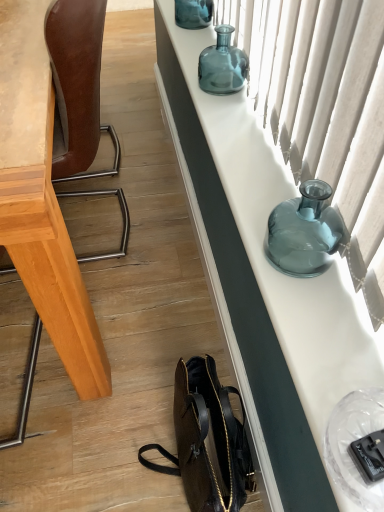
Measure the distance between brown leather handbag at lower center and camera.

They are 34.53 inches apart.

The image size is (384, 512). What do you see at coordinates (263, 281) in the screenshot?
I see `matte glass vase at upper right` at bounding box center [263, 281].

Consider the image. What is the approximate width of brown leather chair at left?

It is 40.43 centimeters.

Find the location of `teal glass vase at upper center, the third bottle when ordered from bottom to top`. teal glass vase at upper center, the third bottle when ordered from bottom to top is located at coordinates (193, 13).

Describe the element at coordinates (193, 13) in the screenshot. Image resolution: width=384 pixels, height=512 pixels. I see `teal glass vase at upper center, the 3th bottle viewed from the front` at that location.

Image resolution: width=384 pixels, height=512 pixels. What do you see at coordinates (304, 232) in the screenshot? I see `translucent glass vase at upper right, the 3th bottle viewed from the top` at bounding box center [304, 232].

Where is `brown leather handbag at lower center`? This screenshot has width=384, height=512. brown leather handbag at lower center is located at coordinates (208, 441).

Is translucent glass vase at upper center, which ranks as the 2th bottle in top-to-bottom order, completely or partially outside of brown leather handbag at lower center?

That's correct, translucent glass vase at upper center, which ranks as the 2th bottle in top-to-bottom order, is outside of brown leather handbag at lower center.

In the image, is translucent glass vase at upper center, the second bottle when ordered from bottom to top, positioned in front of or behind brown leather handbag at lower center?

In the image, translucent glass vase at upper center, the second bottle when ordered from bottom to top, appears behind brown leather handbag at lower center.

Is translucent glass vase at upper center, which ranks as the 2th bottle in top-to-bottom order, with brown leather handbag at lower center?

translucent glass vase at upper center, which ranks as the 2th bottle in top-to-bottom order, and brown leather handbag at lower center are not in contact.

Is translucent glass vase at upper center, the second bottle in the back-to-front sequence, aimed at brown leather handbag at lower center?

No, translucent glass vase at upper center, the second bottle in the back-to-front sequence, does not turn towards brown leather handbag at lower center.

Could you tell me if brown leather handbag at lower center is turned towards translucent glass vase at upper right, positioned as the 1th bottle in front-to-back order?

No.

The width and height of the screenshot is (384, 512). In order to click on bottle that is the 2nd one when counting rightward from the brown leather handbag at lower center in this screenshot , I will do `click(304, 232)`.

Is point (189, 488) closer or farther from the camera than point (318, 264)?

Point (189, 488) appears to be farther away from the viewer than point (318, 264).

Is brown leather handbag at lower center located outside translucent glass vase at upper right, positioned as the 1th bottle in front-to-back order?

brown leather handbag at lower center lies outside translucent glass vase at upper right, positioned as the 1th bottle in front-to-back order,'s area.

Does point (252, 433) come closer to viewer compared to point (224, 29)?

That is True.

Is matte glass vase at upper right bigger than translucent glass vase at upper center, the second bottle viewed from the front?

Correct, matte glass vase at upper right is larger in size than translucent glass vase at upper center, the second bottle viewed from the front.

Considering the relative positions of matte glass vase at upper right and translucent glass vase at upper center, the second bottle viewed from the front, in the image provided, is matte glass vase at upper right to the left of translucent glass vase at upper center, the second bottle viewed from the front, from the viewer's perspective?

Incorrect, matte glass vase at upper right is not on the left side of translucent glass vase at upper center, the second bottle viewed from the front.

Is translucent glass vase at upper center, the second bottle viewed from the front, a part of matte glass vase at upper right?

No, translucent glass vase at upper center, the second bottle viewed from the front, is not a part of matte glass vase at upper right.

Considering the relative sizes of translucent fabric curtain at upper right and brown leather handbag at lower center in the image provided, is translucent fabric curtain at upper right wider than brown leather handbag at lower center?

Incorrect, the width of translucent fabric curtain at upper right does not surpass that of brown leather handbag at lower center.

Is translucent fabric curtain at upper right taller or shorter than brown leather handbag at lower center?

Clearly, translucent fabric curtain at upper right is taller compared to brown leather handbag at lower center.

Does translucent fabric curtain at upper right lie in front of brown leather handbag at lower center?

Yes.

Is translucent glass vase at upper center, the second bottle when ordered from bottom to top, smaller than translucent glass vase at upper right, the first bottle positioned from the bottom?

Indeed, translucent glass vase at upper center, the second bottle when ordered from bottom to top, has a smaller size compared to translucent glass vase at upper right, the first bottle positioned from the bottom.

Is translucent glass vase at upper center, the second bottle in the back-to-front sequence, touching translucent glass vase at upper right, positioned as the 1th bottle in front-to-back order?

No, translucent glass vase at upper center, the second bottle in the back-to-front sequence, is not next to translucent glass vase at upper right, positioned as the 1th bottle in front-to-back order.

From the image's perspective, would you say translucent glass vase at upper center, the second bottle when ordered from bottom to top, is shown under translucent glass vase at upper right, positioned as the 1th bottle in front-to-back order?

Incorrect, from the image's perspective, translucent glass vase at upper center, the second bottle when ordered from bottom to top, is higher than translucent glass vase at upper right, positioned as the 1th bottle in front-to-back order.

You are a GUI agent. You are given a task and a screenshot of the screen. Output one action in this format:
    pyautogui.click(x=<x>, y=<y>)
    Task: Click on the bottle that is the 1st one when counting backward from the translucent glass vase at upper right, the 3th bottle viewed from the top
    
    Given the screenshot: What is the action you would take?
    pyautogui.click(x=222, y=65)

Which of these two, matte glass vase at upper right or brown leather handbag at lower center, stands shorter?

Standing shorter between the two is matte glass vase at upper right.

Identify the location of cabinetry in front of the brown leather handbag at lower center. Image resolution: width=384 pixels, height=512 pixels. (263, 281).

Which is correct: matte glass vase at upper right is inside brown leather handbag at lower center, or outside of it?

matte glass vase at upper right lies outside brown leather handbag at lower center.

Can you confirm if matte glass vase at upper right is bigger than brown leather handbag at lower center?

No, matte glass vase at upper right is not bigger than brown leather handbag at lower center.

From the picture: Would you say brown leather handbag at lower center is a long distance from translucent fabric curtain at upper right?

brown leather handbag at lower center is actually quite close to translucent fabric curtain at upper right.

From a real-world perspective, is brown leather handbag at lower center positioned above or below translucent fabric curtain at upper right?

brown leather handbag at lower center is situated lower than translucent fabric curtain at upper right in the real world.

From the image's perspective, between brown leather handbag at lower center and translucent fabric curtain at upper right, who is located below?

brown leather handbag at lower center is shown below in the image.

Where is `handbag directly beneath the translucent glass vase at upper center, the second bottle in the back-to-front sequence (from a real-world perspective)`? handbag directly beneath the translucent glass vase at upper center, the second bottle in the back-to-front sequence (from a real-world perspective) is located at coordinates (208, 441).

Find the location of a particular element. The width and height of the screenshot is (384, 512). handbag on the left of translucent glass vase at upper right, positioned as the 1th bottle in front-to-back order is located at coordinates (208, 441).

When comparing their distances from translucent glass vase at upper right, acting as the third bottle starting from the back, does translucent glass vase at upper center, the second bottle viewed from the front, or translucent fabric curtain at upper right seem further?

The object further to translucent glass vase at upper right, acting as the third bottle starting from the back, is translucent glass vase at upper center, the second bottle viewed from the front.

Which object lies further to the anchor point matte glass vase at upper right, teal glass vase at upper center, the 1th bottle in the top-to-bottom sequence, or brown leather handbag at lower center?

teal glass vase at upper center, the 1th bottle in the top-to-bottom sequence, is further to matte glass vase at upper right.

Which object lies further to the anchor point translucent glass vase at upper right, the first bottle positioned from the bottom, translucent fabric curtain at upper right or translucent glass vase at upper center, which ranks as the 2th bottle in top-to-bottom order?

Among the two, translucent glass vase at upper center, which ranks as the 2th bottle in top-to-bottom order, is located further to translucent glass vase at upper right, the first bottle positioned from the bottom.

Which object lies nearer to the anchor point matte glass vase at upper right, brown leather chair at left or translucent glass vase at upper center, the second bottle when ordered from bottom to top?

translucent glass vase at upper center, the second bottle when ordered from bottom to top.

When comparing their distances from translucent fabric curtain at upper right, does matte glass vase at upper right or translucent glass vase at upper center, the second bottle when ordered from bottom to top, seem closer?

Based on the image, matte glass vase at upper right appears to be nearer to translucent fabric curtain at upper right.

When comparing their distances from matte glass vase at upper right, does teal glass vase at upper center, the 1th bottle in the top-to-bottom sequence, or translucent glass vase at upper center, which ranks as the 2th bottle in top-to-bottom order, seem further?

Among the two, teal glass vase at upper center, the 1th bottle in the top-to-bottom sequence, is located further to matte glass vase at upper right.

Which object lies nearer to the anchor point brown leather chair at left, translucent glass vase at upper center, which ranks as the 2th bottle in top-to-bottom order, or translucent glass vase at upper right, the first bottle positioned from the bottom?

translucent glass vase at upper center, which ranks as the 2th bottle in top-to-bottom order, is closer to brown leather chair at left.

Based on their spatial positions, is teal glass vase at upper center, the 1th bottle in the top-to-bottom sequence, or matte glass vase at upper right further from translucent glass vase at upper center, the second bottle in the back-to-front sequence?

The object further to translucent glass vase at upper center, the second bottle in the back-to-front sequence, is matte glass vase at upper right.

Locate an element on the screen. Image resolution: width=384 pixels, height=512 pixels. cabinetry between teal glass vase at upper center, the 3th bottle viewed from the front, and brown leather handbag at lower center, in the vertical direction is located at coordinates (263, 281).

Locate an element on the screen. chair that lies between teal glass vase at upper center, the 1th bottle in the top-to-bottom sequence, and brown leather handbag at lower center from top to bottom is located at coordinates (77, 87).

Locate an element on the screen. Image resolution: width=384 pixels, height=512 pixels. chair positioned between translucent fabric curtain at upper right and translucent glass vase at upper center, the second bottle when ordered from bottom to top, from near to far is located at coordinates (77, 87).

Image resolution: width=384 pixels, height=512 pixels. What are the coordinates of `chair between teal glass vase at upper center, the 1th bottle in the top-to-bottom sequence, and translucent glass vase at upper right, positioned as the 1th bottle in front-to-back order, in the up-down direction` in the screenshot? It's located at (77, 87).